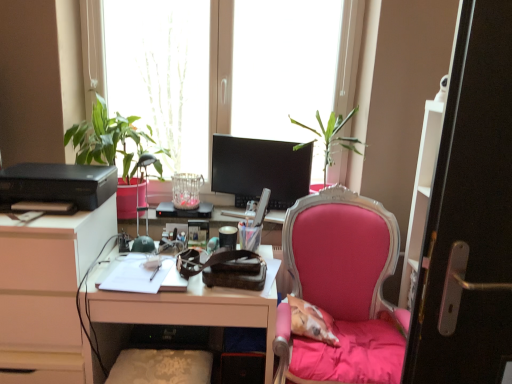
Question: Considering the relative sizes of matte black monitor at center and white glossy desk at center in the image provided, is matte black monitor at center smaller than white glossy desk at center?

Choices:
 (A) no
 (B) yes

Answer: (B)

Question: Is matte black monitor at center to the left of white glossy desk at center from the viewer's perspective?

Choices:
 (A) no
 (B) yes

Answer: (A)

Question: Is matte black monitor at center looking in the opposite direction of white glossy desk at center?

Choices:
 (A) no
 (B) yes

Answer: (A)

Question: Is matte black monitor at center next to white glossy desk at center and touching it?

Choices:
 (A) yes
 (B) no

Answer: (B)

Question: Is matte black monitor at center behind white glossy desk at center?

Choices:
 (A) no
 (B) yes

Answer: (B)

Question: Looking at the image, does green matte lamp at left seem bigger or smaller compared to transparent glass window at upper center?

Choices:
 (A) small
 (B) big

Answer: (A)

Question: In terms of width, does green matte lamp at left look wider or thinner when compared to transparent glass window at upper center?

Choices:
 (A) wide
 (B) thin

Answer: (A)

Question: Is point (156, 160) positioned closer to the camera than point (161, 135)?

Choices:
 (A) closer
 (B) farther

Answer: (A)

Question: From the image's perspective, is green matte lamp at left above or below transparent glass window at upper center?

Choices:
 (A) below
 (B) above

Answer: (A)

Question: Looking at the image, does pink fabric chair at center seem bigger or smaller compared to white glossy desk at center?

Choices:
 (A) small
 (B) big

Answer: (B)

Question: Is point (337, 193) positioned closer to the camera than point (101, 269)?

Choices:
 (A) closer
 (B) farther

Answer: (B)

Question: Visually, is pink fabric chair at center positioned to the left or to the right of white glossy desk at center?

Choices:
 (A) right
 (B) left

Answer: (A)

Question: From a real-world perspective, is pink fabric chair at center above or below white glossy desk at center?

Choices:
 (A) below
 (B) above

Answer: (B)

Question: Is point (326, 377) positioned closer to the camera than point (91, 59)?

Choices:
 (A) farther
 (B) closer

Answer: (B)

Question: Is pink fabric chair at center taller or shorter than transparent glass window at upper center?

Choices:
 (A) short
 (B) tall

Answer: (A)